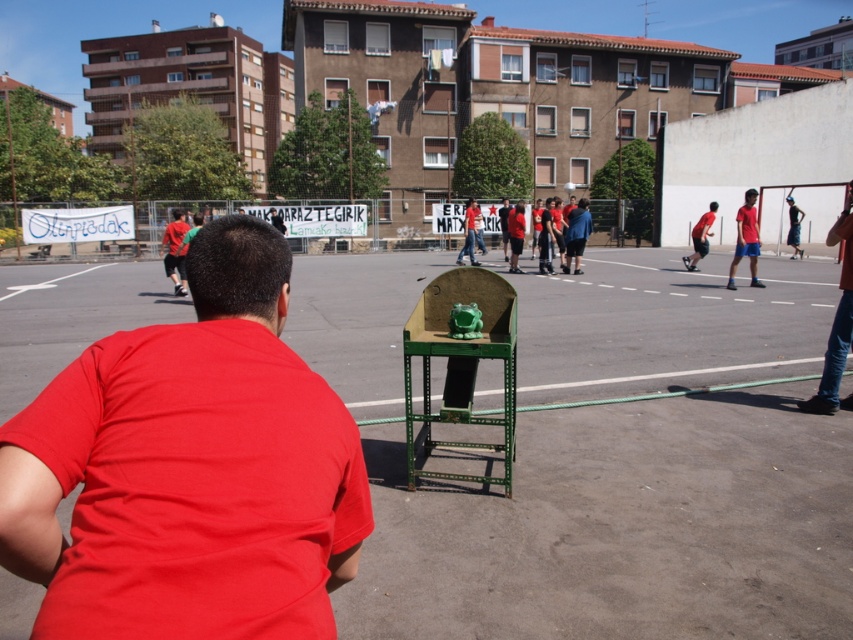
Measure the distance between red matte shirt at center and camera.

red matte shirt at center is 4.03 feet away from camera.

Describe the element at coordinates (190, 468) in the screenshot. The width and height of the screenshot is (853, 640). I see `red matte shirt at center` at that location.

Is point (219, 476) closer to camera compared to point (791, 214)?

That is True.

Find the location of a particular element. This screenshot has width=853, height=640. red matte shirt at center is located at coordinates (190, 468).

Does green matte table at center appear on the left side of denim shorts at center?

Yes, green matte table at center is to the left of denim shorts at center.

Measure the distance between green matte table at center and camera.

A distance of 3.24 meters exists between green matte table at center and camera.

Who is more forward, (334,268) or (790,257)?

Positioned in front is point (334,268).

At what (x,y) coordinates should I click in order to perform the action: click on green matte table at center. Please return your answer as a coordinate pair (x, y). Image resolution: width=853 pixels, height=640 pixels. Looking at the image, I should click on (621, 528).

Is red matte shirt at center to the left of jeans at right from the viewer's perspective?

Indeed, red matte shirt at center is positioned on the left side of jeans at right.

Is the position of red matte shirt at center less distant than that of jeans at right?

That is True.

Who is more forward, (256,548) or (830,358)?

Point (256,548) is in front.

This screenshot has height=640, width=853. What are the coordinates of `red matte shirt at center` in the screenshot? It's located at (190, 468).